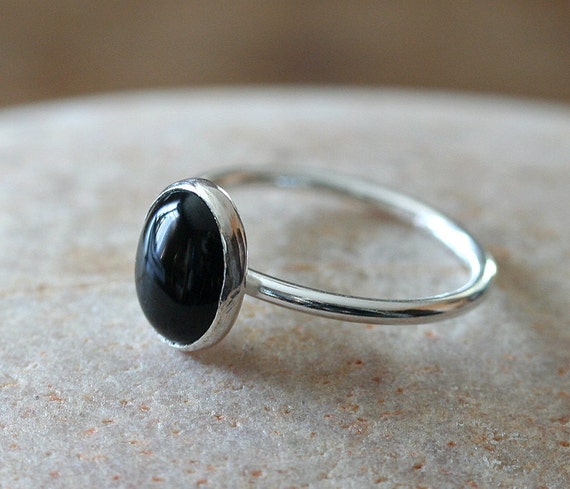
Where is `spots on white carpet`? The width and height of the screenshot is (570, 489). spots on white carpet is located at coordinates (414, 465), (357, 406), (380, 380), (488, 443), (557, 442), (560, 416), (557, 370), (52, 396), (89, 427), (108, 421).